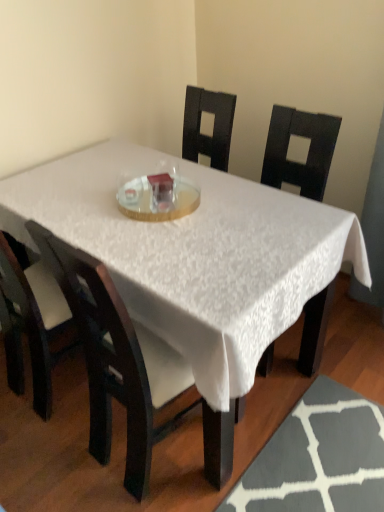
I want to click on vacant space to the left of matte black chair at center, acting as the 2th chair starting from the left, so click(48, 459).